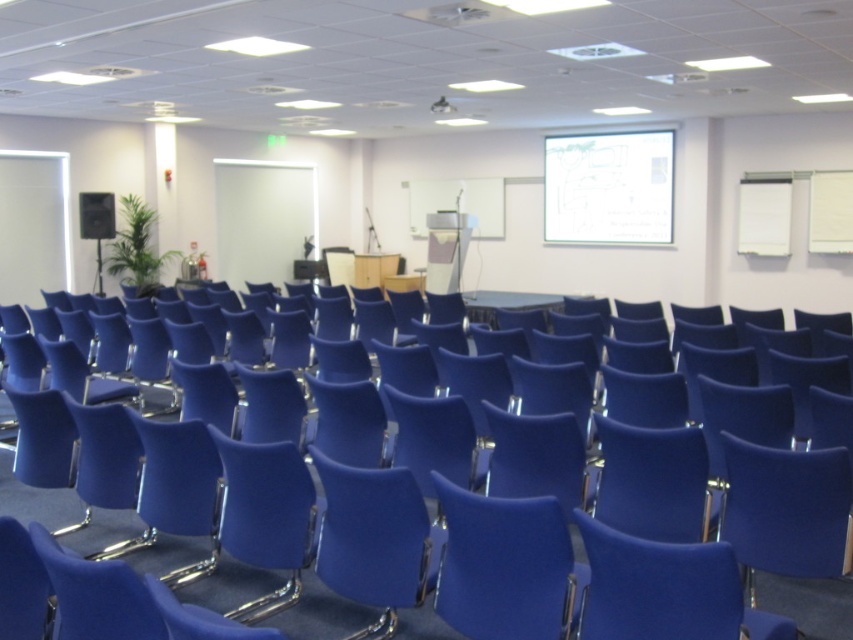
Which is in front, point (558, 632) or point (624, 161)?

Positioned in front is point (558, 632).

Is blue fabric swivel chair at center wider than white paper at upper center?

No, blue fabric swivel chair at center is not wider than white paper at upper center.

Which is behind, point (445, 568) or point (622, 224)?

Point (622, 224)

At what (x,y) coordinates should I click in order to perform the action: click on blue fabric swivel chair at center. Please return your answer as a coordinate pair (x, y). The height and width of the screenshot is (640, 853). Looking at the image, I should click on (505, 566).

In the scene shown: Who is higher up, blue fabric swivel chair at center or matte black speaker at left?

matte black speaker at left

Does blue fabric swivel chair at center appear on the left side of matte black speaker at left?

No, blue fabric swivel chair at center is not to the left of matte black speaker at left.

Is point (457, 541) less distant than point (113, 236)?

Yes, point (457, 541) is closer to viewer.

At what (x,y) coordinates should I click in order to perform the action: click on blue fabric swivel chair at center. Please return your answer as a coordinate pair (x, y). The height and width of the screenshot is (640, 853). Looking at the image, I should click on (505, 566).

Between matte blue chair at center and white paper at upper center, which one appears on the left side from the viewer's perspective?

matte blue chair at center is more to the left.

Does matte blue chair at center come behind white paper at upper center?

No, matte blue chair at center is closer to the viewer.

Describe the element at coordinates (375, 540) in the screenshot. I see `matte blue chair at center` at that location.

At what (x,y) coordinates should I click in order to perform the action: click on matte blue chair at center. Please return your answer as a coordinate pair (x, y). Image resolution: width=853 pixels, height=640 pixels. Looking at the image, I should click on (375, 540).